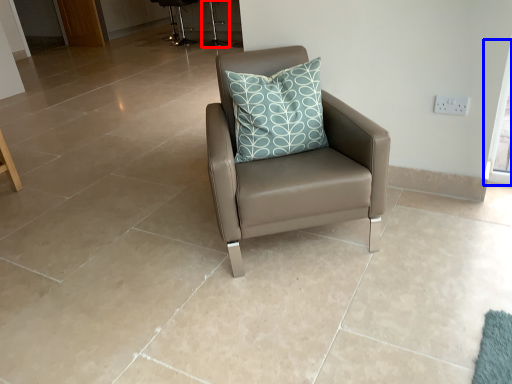
Question: Which of the following is the closest to the observer, bar stool (highlighted by a red box) or window screen (highlighted by a blue box)?

Choices:
 (A) bar stool
 (B) window screen

Answer: (B)